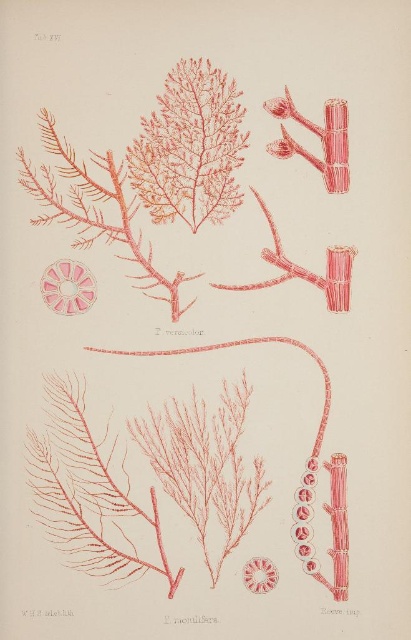
You are an assistant helping a student identify the location of the matte pink seaweed in the botanical illustration. The student says they can see a point marked at coordinates (189, 147). Can you confirm if this point is where the matte pink seaweed at upper center is located?

Yes, the point at coordinates (189, 147) corresponds to the matte pink seaweed at upper center as described in the objects description.

Based on the provided coordinates, which object corresponds to the point labeled as point (94, 209)?

The point labeled as point (94, 209) corresponds to the pink matte branch at upper left.